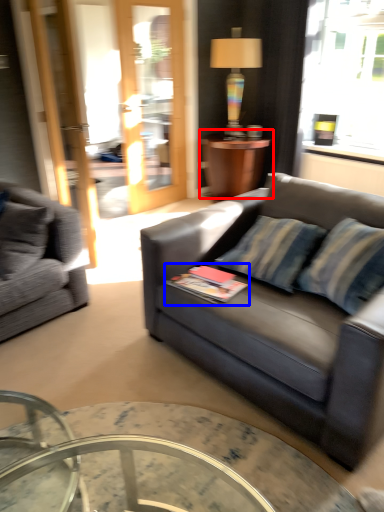
Question: Which object appears closest to the camera in this image, table (highlighted by a red box) or book (highlighted by a blue box)?

Choices:
 (A) table
 (B) book

Answer: (B)